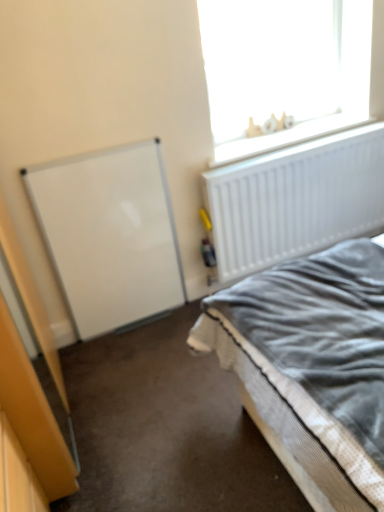
Question: From a real-world perspective, is textured gray bed at lower right located beneath white plastic letters at upper right?

Choices:
 (A) yes
 (B) no

Answer: (A)

Question: Does textured gray bed at lower right have a lesser width compared to white plastic letters at upper right?

Choices:
 (A) yes
 (B) no

Answer: (B)

Question: Is the position of textured gray bed at lower right more distant than that of white plastic letters at upper right?

Choices:
 (A) yes
 (B) no

Answer: (B)

Question: Is textured gray bed at lower right smaller than white plastic letters at upper right?

Choices:
 (A) no
 (B) yes

Answer: (A)

Question: Is textured gray bed at lower right at the left side of white plastic letters at upper right?

Choices:
 (A) yes
 (B) no

Answer: (A)

Question: Is white matte love sign at upper right in front of or behind textured gray bed at lower right in the image?

Choices:
 (A) behind
 (B) front

Answer: (A)

Question: From a real-world perspective, is white matte love sign at upper right above or below textured gray bed at lower right?

Choices:
 (A) above
 (B) below

Answer: (A)

Question: Is point (215, 159) closer or farther from the camera than point (244, 303)?

Choices:
 (A) closer
 (B) farther

Answer: (B)

Question: In the image, is white matte love sign at upper right on the left side or the right side of textured gray bed at lower right?

Choices:
 (A) left
 (B) right

Answer: (B)

Question: Visually, is textured gray bed at lower right positioned to the left or to the right of white matte love sign at upper right?

Choices:
 (A) left
 (B) right

Answer: (A)

Question: Considering the positions of point (322, 295) and point (349, 83), is point (322, 295) closer or farther from the camera than point (349, 83)?

Choices:
 (A) farther
 (B) closer

Answer: (B)

Question: Looking at the image, does textured gray bed at lower right seem bigger or smaller compared to white matte love sign at upper right?

Choices:
 (A) big
 (B) small

Answer: (B)

Question: From a real-world perspective, relative to white matte love sign at upper right, is textured gray bed at lower right vertically above or below?

Choices:
 (A) above
 (B) below

Answer: (B)

Question: Considering the positions of point (296, 139) and point (225, 27), is point (296, 139) closer or farther from the camera than point (225, 27)?

Choices:
 (A) closer
 (B) farther

Answer: (B)

Question: Considering the positions of white plastic letters at upper right and white matte love sign at upper right in the image, is white plastic letters at upper right taller or shorter than white matte love sign at upper right?

Choices:
 (A) short
 (B) tall

Answer: (A)